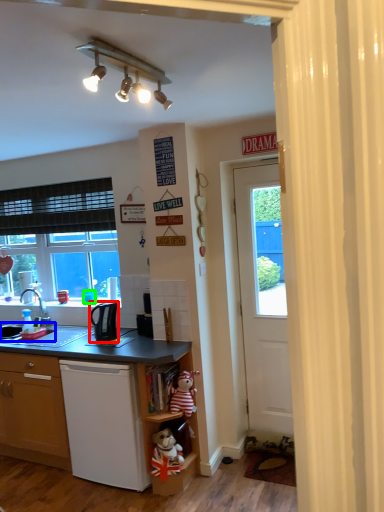
Question: Which is farther away from corded phone (highlighted by a red box)? sink (highlighted by a blue box) or coffee cup (highlighted by a green box)?

Choices:
 (A) sink
 (B) coffee cup

Answer: (A)